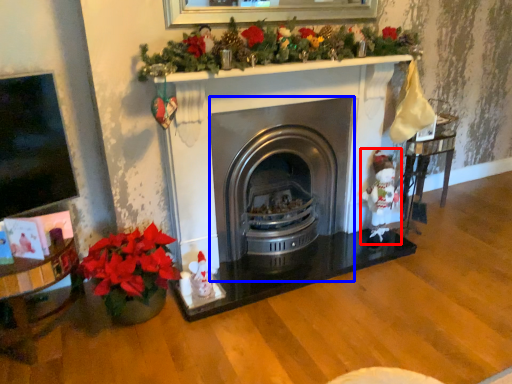
Question: Which object is closer to the camera taking this photo, santa claus (highlighted by a red box) or wood burning stove (highlighted by a blue box)?

Choices:
 (A) santa claus
 (B) wood burning stove

Answer: (B)